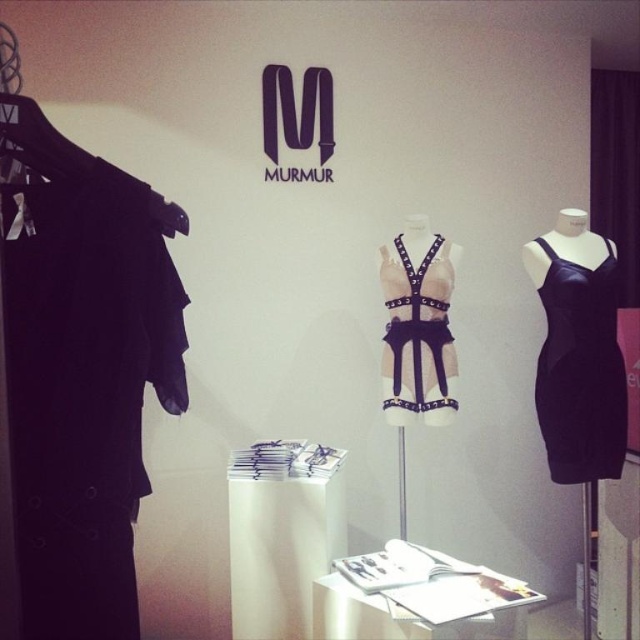
In the Murmur boutique, you see a satin black dress at right and a leather harness at center. Which item is positioned further to the right?

The satin black dress at right is positioned further to the right than the leather harness at center.

You are a customer in the store and want to know which item is bigger between the satin black dress at right and the leather harness at center. Can you tell me?

The satin black dress at right is larger in size than the leather harness at center.

You are a customer in the store and want to touch the two points on the display. Which point, point 1 at coordinates (x=552, y=404) or point 2 at coordinates (x=401, y=292), will be easier to reach without moving your position?

Point 1 at coordinates (x=552, y=404) is closer to the camera, so it will be easier to reach without moving your position.